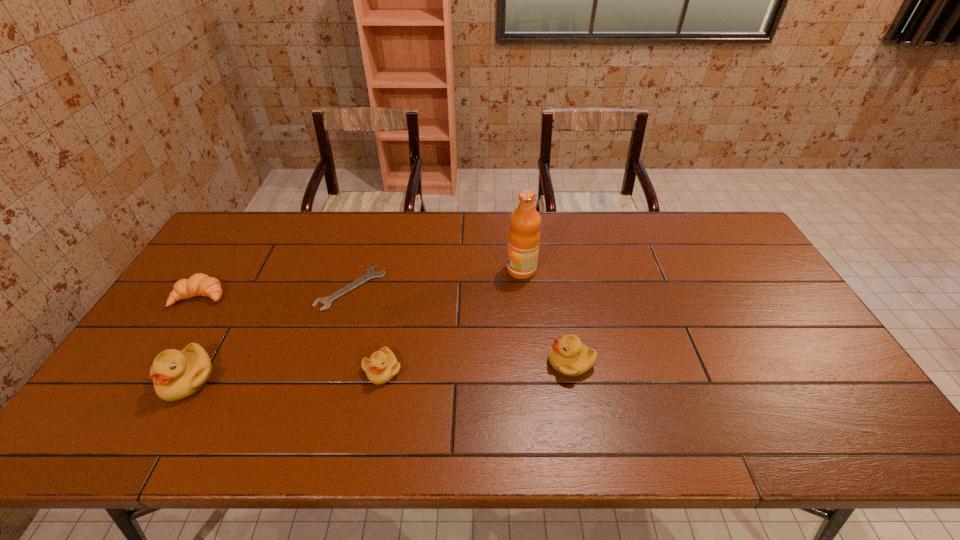
This screenshot has width=960, height=540. In the image, there is a desktop. Find the location of `vacant area at the far edge`. vacant area at the far edge is located at coordinates (344, 230).

What are the coordinates of `free space at the near edge` in the screenshot? It's located at (x=573, y=407).

In the image, there is a desktop. In order to click on free space at the left edge in this screenshot , I will do `click(245, 274)`.

Identify the location of vacant space at the right edge of the desktop. (709, 263).

Where is `free region at the near right corner of the desktop`? This screenshot has width=960, height=540. free region at the near right corner of the desktop is located at coordinates (821, 402).

Where is `blank region between the rightmost duckling and the tallest object`? The image size is (960, 540). blank region between the rightmost duckling and the tallest object is located at coordinates (546, 316).

I want to click on free space between the second tallest duckling and the third shortest object, so click(477, 367).

At what (x,y) coordinates should I click in order to perform the action: click on free space that is in between the shortest object and the fourth tallest object. Please return your answer as a coordinate pair (x, y). The width and height of the screenshot is (960, 540). Looking at the image, I should click on (367, 329).

Locate an element on the screen. unoccupied position between the tallest object and the third shortest object is located at coordinates (452, 320).

This screenshot has height=540, width=960. I want to click on free space that is in between the second shortest duckling and the shortest object, so click(461, 325).